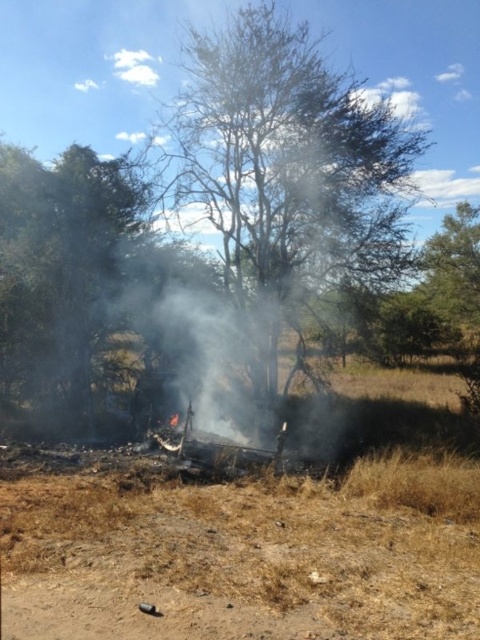
You are a firefighter assessing the fire scene. You notice a brown leafy tree at center and a green leafy tree at left. Which tree is closer to the fire? The fire is located near the remnants of the structure in the middle ground.

The brown leafy tree at center is closer to the fire because it is only 25.32 feet away from the green leafy tree at left, but the fire is near the structure in the middle ground. However, without knowing the exact distance from each tree to the fire, we cannot determine which is closer based solely on their separation distance. Please provide more information about their positions relative to the fire.

You are a firefighter assessing the scene. You see the point marked at coordinates (229, 563), which corresponds to an object in the image. What is the object located at that point?

Answer: The point at coordinates (229, 563) indicates brown dry grass at lower center.